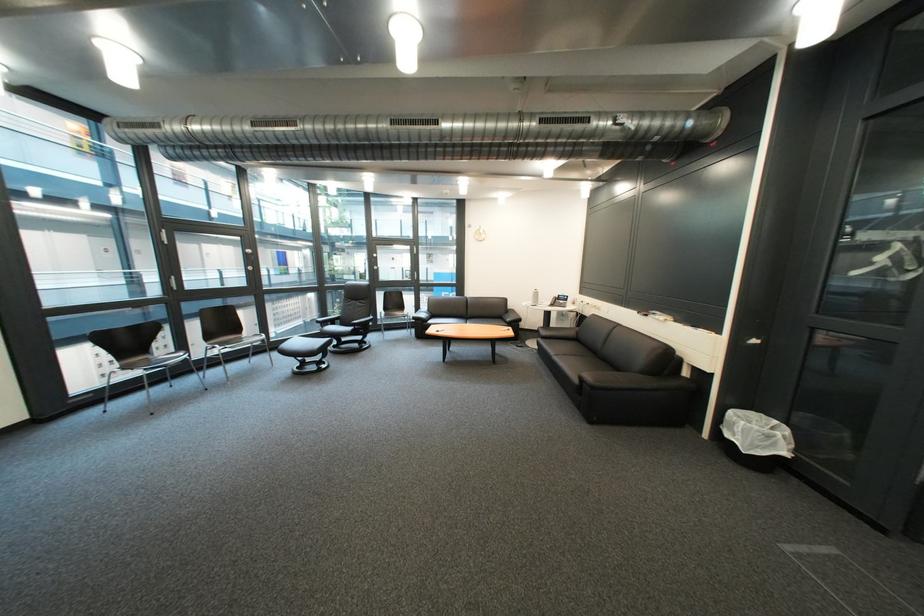
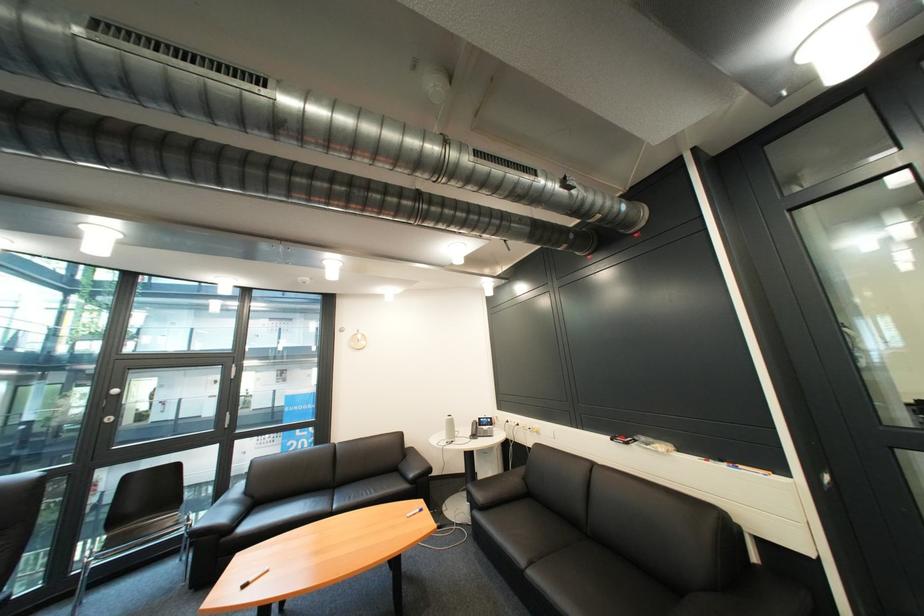
In the second image, find the point that corresponds to the point at 569,360 in the first image.

(546, 577)